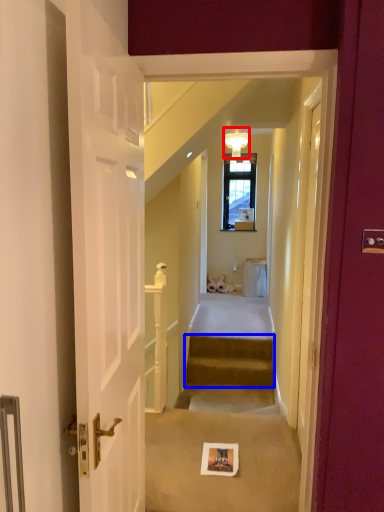
Question: Which of the following is the farthest to the observer, light fixture (highlighted by a red box) or stairs (highlighted by a blue box)?

Choices:
 (A) light fixture
 (B) stairs

Answer: (A)